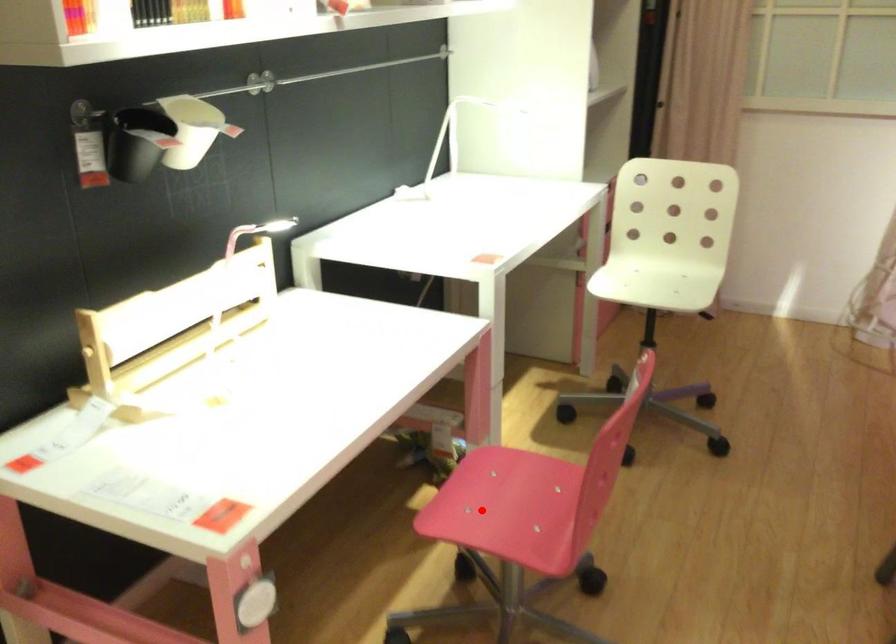
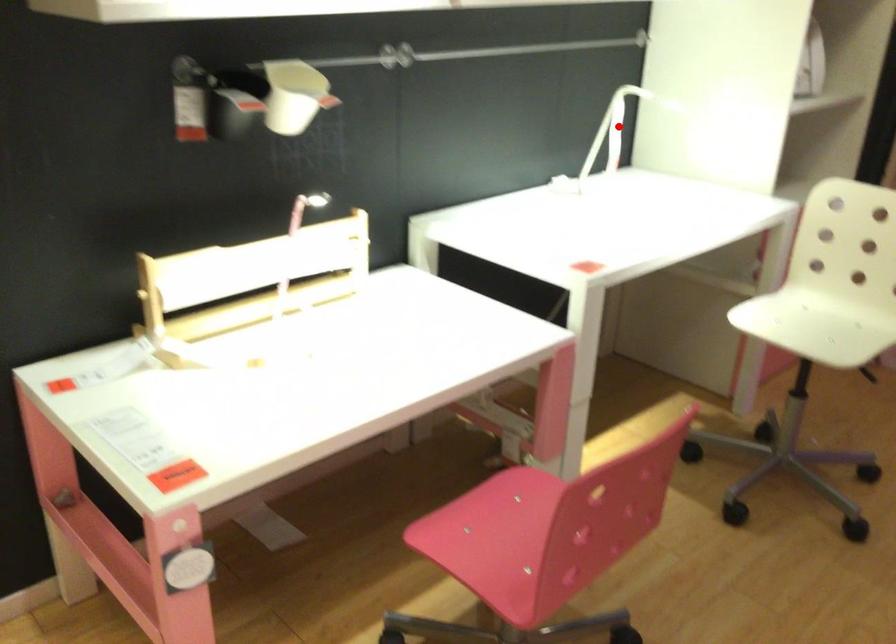
I am providing you with two images of the same scene from different viewpoints. A red point is marked on the first image and another point is marked on the second image. Are the points marked in image1 and image2 representing the same 3D position?

No